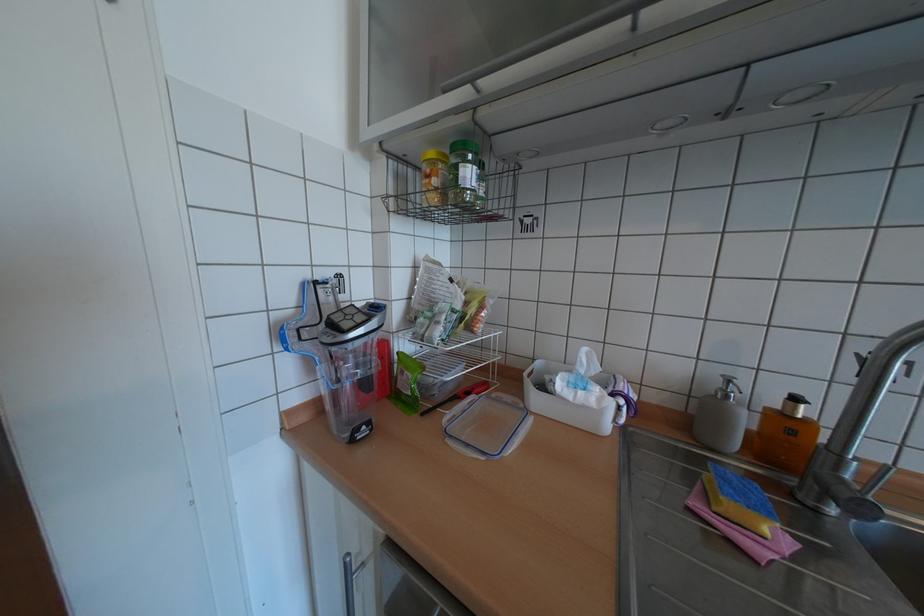
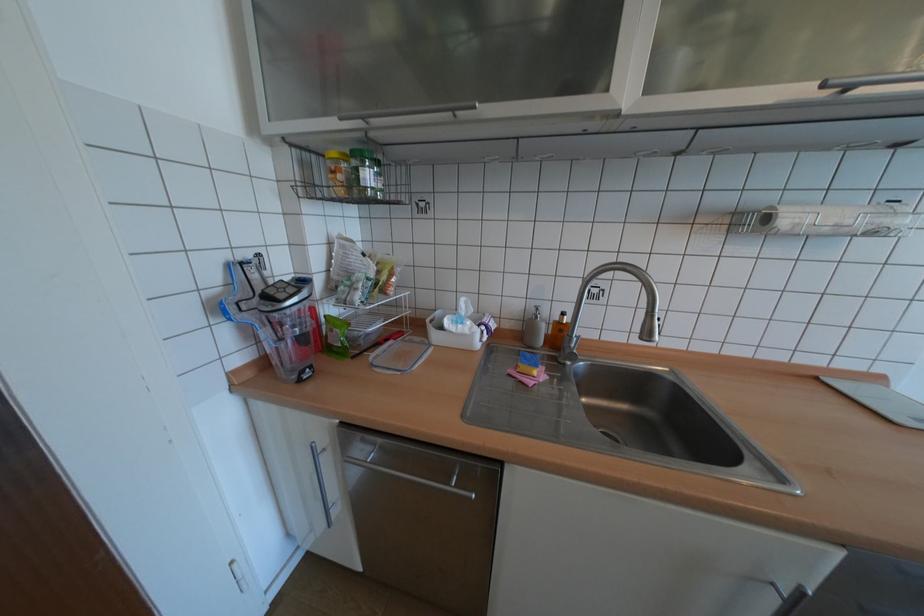
Find the pixel in the second image that matches [723,508] in the first image.

(527, 371)